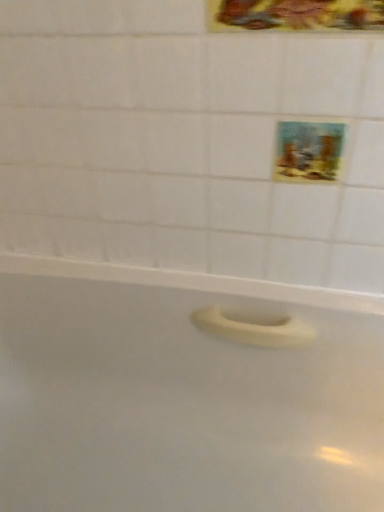
Question: Does pastel painted picture at upper right, placed as the second decorative picture when sorted from top to bottom, have a greater height compared to white matte bathtub at center?

Choices:
 (A) yes
 (B) no

Answer: (B)

Question: From a real-world perspective, is pastel painted picture at upper right, placed as the first decorative picture when sorted from back to front, under white matte bathtub at center?

Choices:
 (A) yes
 (B) no

Answer: (B)

Question: Considering the relative sizes of pastel painted picture at upper right, positioned as the second decorative picture in front-to-back order, and white matte bathtub at center in the image provided, is pastel painted picture at upper right, positioned as the second decorative picture in front-to-back order, smaller than white matte bathtub at center?

Choices:
 (A) yes
 (B) no

Answer: (A)

Question: Is pastel painted picture at upper right, positioned as the second decorative picture in front-to-back order, in front of white matte bathtub at center?

Choices:
 (A) yes
 (B) no

Answer: (B)

Question: Is pastel painted picture at upper right, placed as the second decorative picture when sorted from top to bottom, positioned far away from white matte bathtub at center?

Choices:
 (A) no
 (B) yes

Answer: (A)

Question: From the image's perspective, would you say pastel painted picture at upper right, placed as the second decorative picture when sorted from top to bottom, is shown under white matte bathtub at center?

Choices:
 (A) no
 (B) yes

Answer: (A)

Question: Does metallic gold frame at upper center, arranged as the first decorative picture when viewed from the top, have a greater height compared to pastel painted picture at upper right, placed as the second decorative picture when sorted from top to bottom?

Choices:
 (A) no
 (B) yes

Answer: (B)

Question: From a real-world perspective, is metallic gold frame at upper center, arranged as the first decorative picture when viewed from the top, positioned under pastel painted picture at upper right, placed as the second decorative picture when sorted from top to bottom, based on gravity?

Choices:
 (A) yes
 (B) no

Answer: (B)

Question: Is metallic gold frame at upper center, the 2th decorative picture ordered from the bottom, positioned beyond the bounds of pastel painted picture at upper right, the 1th decorative picture positioned from the bottom?

Choices:
 (A) no
 (B) yes

Answer: (B)

Question: Does metallic gold frame at upper center, the 2th decorative picture ordered from the bottom, appear on the left side of pastel painted picture at upper right, the 1th decorative picture positioned from the bottom?

Choices:
 (A) yes
 (B) no

Answer: (A)

Question: Does metallic gold frame at upper center, marked as the 2th decorative picture in a back-to-front arrangement, have a greater width compared to pastel painted picture at upper right, placed as the first decorative picture when sorted from back to front?

Choices:
 (A) yes
 (B) no

Answer: (B)

Question: Are metallic gold frame at upper center, the 2th decorative picture ordered from the bottom, and pastel painted picture at upper right, placed as the second decorative picture when sorted from top to bottom, making contact?

Choices:
 (A) no
 (B) yes

Answer: (A)

Question: From the image's perspective, does white matte bathtub at center appear higher than pastel painted picture at upper right, placed as the second decorative picture when sorted from top to bottom?

Choices:
 (A) no
 (B) yes

Answer: (A)